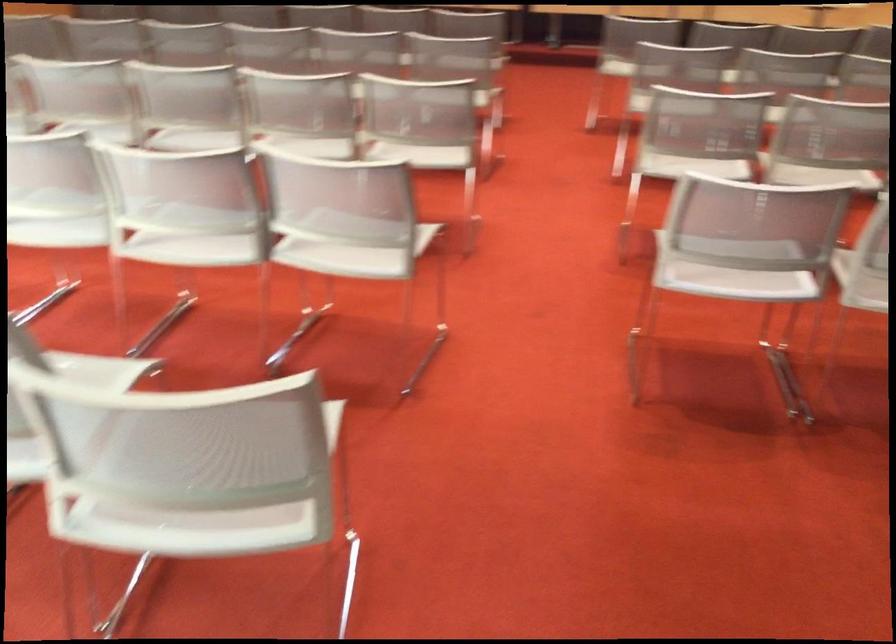
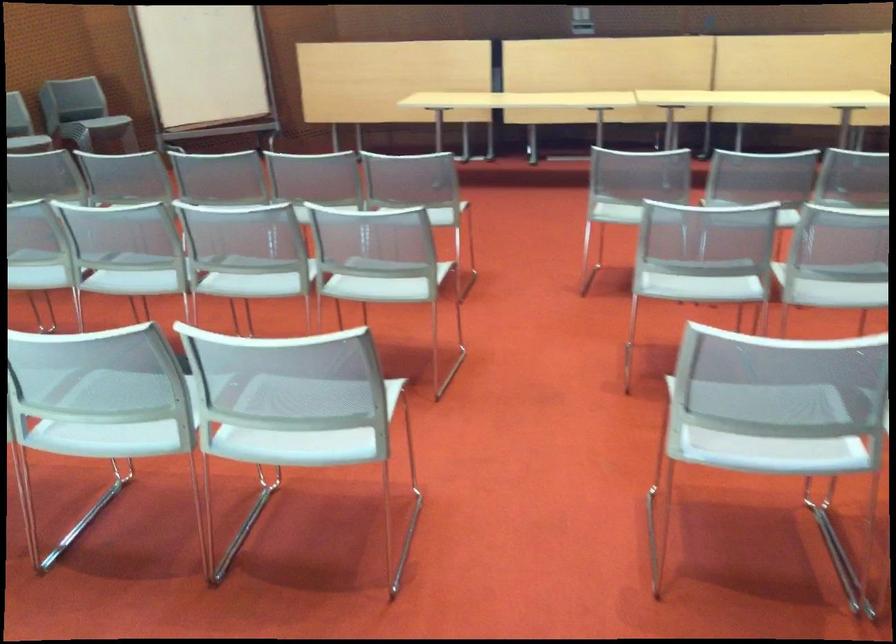
Question: What movement of the cameraman would produce the second image?

Choices:
 (A) Left
 (B) Right
 (C) Forward
 (D) Backward

Answer: (C)